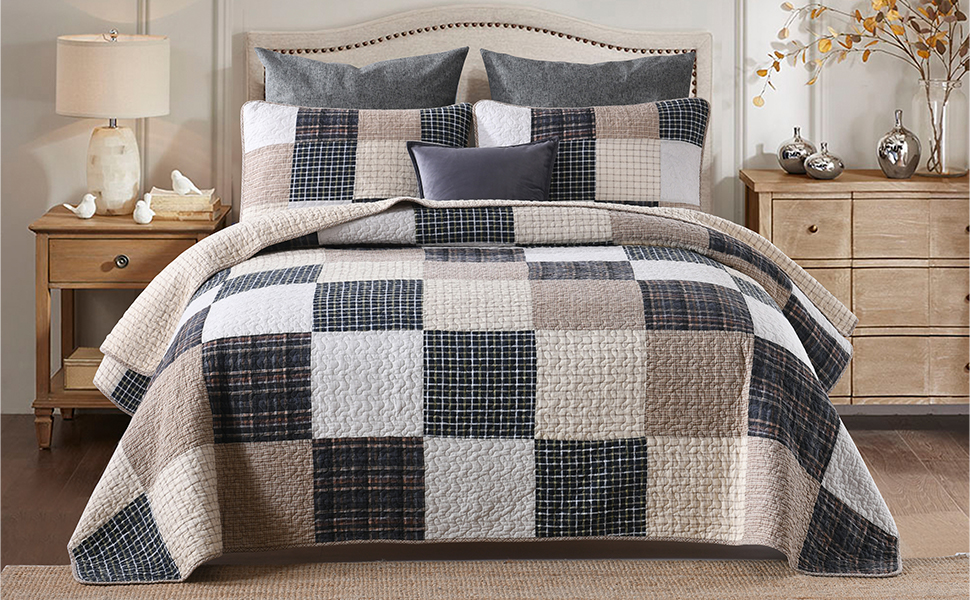
In order to click on lamp in this screenshot , I will do `click(107, 159)`.